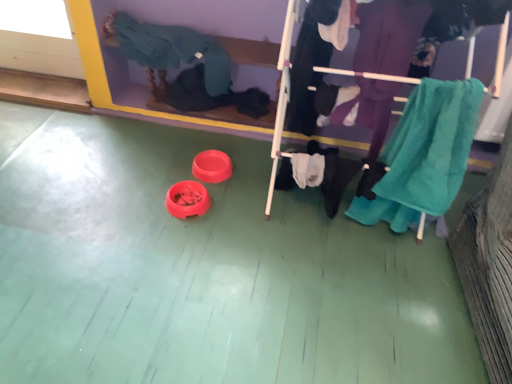
You are a GUI agent. You are given a task and a screenshot of the screen. Output one action in this format:
    pyautogui.click(x=<x>, y=<y>)
    Task: Click on the free space on the front side of black cotton pants at center, which is counted as the 2th clothing, starting from the left
    The height and width of the screenshot is (384, 512).
    Given the screenshot: What is the action you would take?
    coord(311,269)